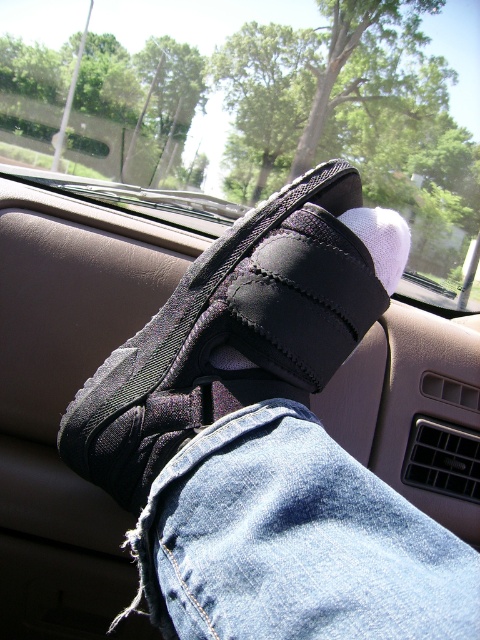
You are a passenger in the car and want to check if your denim at center is covering your black fabric shoe at center. Based on the scene, can you confirm if the denim is indeed covering the shoe?

The denim at center is in front of the black fabric shoe at center, so yes, the denim is covering the shoe.

You are a passenger in the car and want to open the transparent glass car window at center to let in more fresh air. However, you notice that the window is currently closed. Can you reach the window from your current position?

The transparent glass car window at center is 5.16 meters from viewer, which is too far to reach from the passenger seat. You cannot open it without moving closer.

You are a car seat cover installer. You need to place a new seat cover on the car seat where the denim at center and the black fabric shoe at center are currently resting. Which object should you move first to access the seat properly?

You should move the black fabric shoe at center first because it occupies more space than the denim at center, making it easier to access the seat once it is removed.